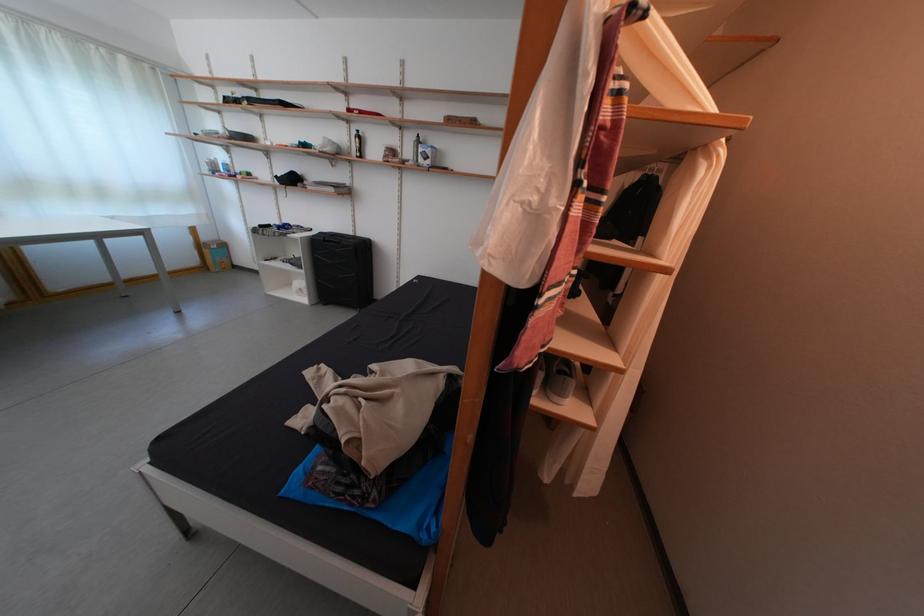
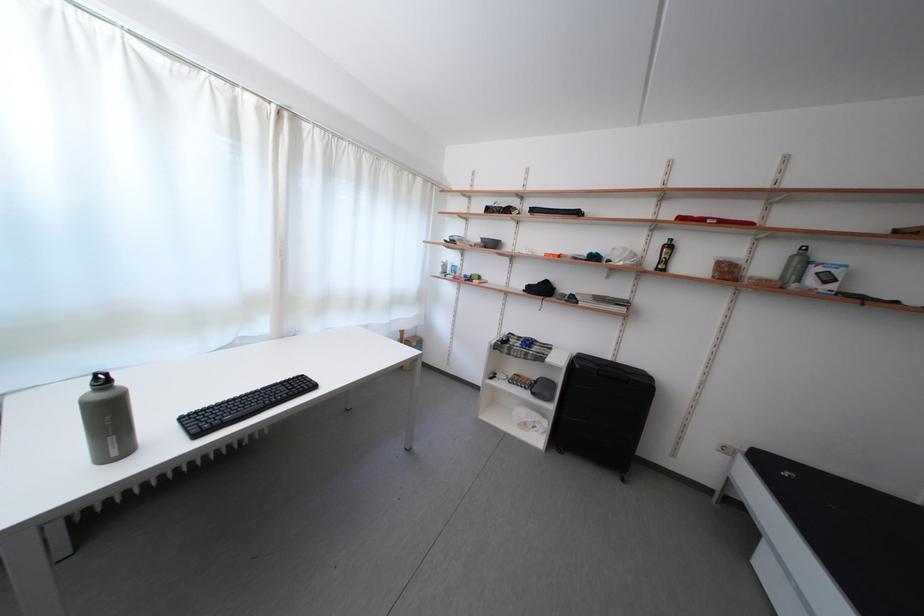
Where in the second image is the point corresponding to [359,238] from the first image?

(617, 363)